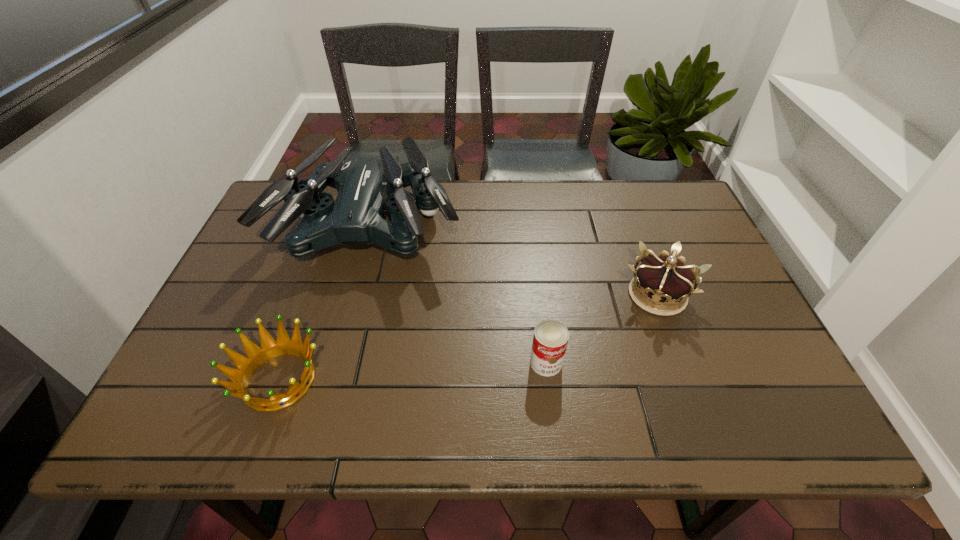
Image resolution: width=960 pixels, height=540 pixels. In order to click on vacant space at the far left corner of the desktop in this screenshot , I will do `click(326, 189)`.

Locate an element on the screen. The image size is (960, 540). vacant space at the near left corner of the desktop is located at coordinates (183, 437).

At what (x,y) coordinates should I click in order to perform the action: click on vacant region at the far right corner of the desktop. Please return your answer as a coordinate pair (x, y). This screenshot has width=960, height=540. Looking at the image, I should click on (691, 210).

The height and width of the screenshot is (540, 960). In order to click on vacant space at the near right corner in this screenshot , I will do `click(775, 404)`.

Find the location of a particular element. The image size is (960, 540). vacant area that lies between the drone and the second object from right to left is located at coordinates (459, 294).

The width and height of the screenshot is (960, 540). Find the location of `vacant point located between the second object from right to left and the second tallest object`. vacant point located between the second object from right to left and the second tallest object is located at coordinates (602, 329).

Locate an element on the screen. The image size is (960, 540). free area in between the drone and the second tallest object is located at coordinates (515, 261).

Where is `vacant space that's between the third object from left to right and the drone`? vacant space that's between the third object from left to right and the drone is located at coordinates (459, 294).

I want to click on unoccupied position between the third object from left to right and the rightmost object, so click(x=602, y=329).

I want to click on empty space between the nearer crown and the farther crown, so click(468, 337).